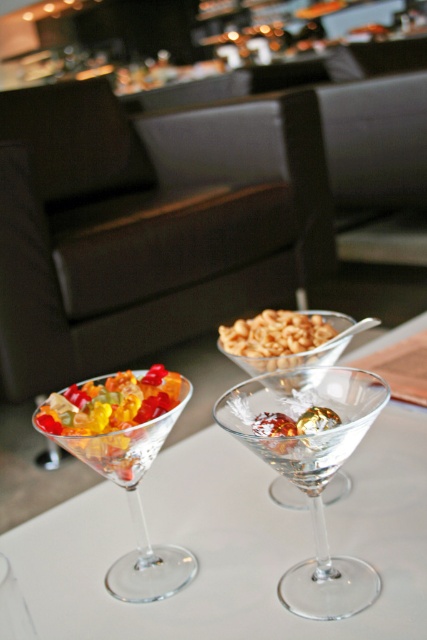
You are a bartender preparing a drink and need to choose between the transparent glass at center and the translucent glass bowl at center. Which one has a smaller width?

The transparent glass at center has a smaller width than the translucent glass bowl at center.

Consider the image. You are at a bar and want to place a small coaster under the translucent glass martini glass at lower left to prevent condensation. Given that the coaster has a diameter of 10 cm, can you confirm if there is enough space around the glass to place it without touching the other objects?

The translucent glass martini glass at lower left is located at point (125, 461). Since the coaster requires 10 cm of space, and the description does not mention any nearby objects obstructing this area, it should be possible to place the coaster without touching other items.